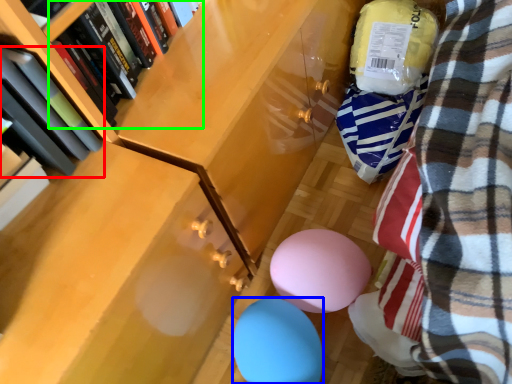
Question: Which object is the closest to the book (highlighted by a red box)? Choose among these: balloon (highlighted by a blue box) or book (highlighted by a green box).

Choices:
 (A) balloon
 (B) book

Answer: (B)